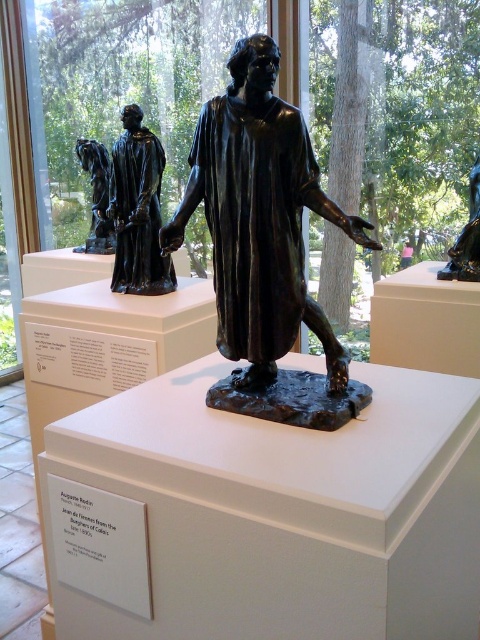
Question: Which point appears closest to the camera in this image?

Choices:
 (A) (350, 404)
 (B) (128, 140)
 (C) (80, 138)
 (D) (479, 272)

Answer: (A)

Question: Among these objects, which one is nearest to the camera?

Choices:
 (A) shiny bronze statue at left
 (B) bronze statue at left

Answer: (A)

Question: Which object is farther from the camera taking this photo?

Choices:
 (A) bronze statue at left
 (B) shiny bronze statue at left
 (C) shiny bronze statue at center

Answer: (A)

Question: Does shiny bronze statue at left have a larger size compared to bronze statue at left?

Choices:
 (A) yes
 (B) no

Answer: (B)

Question: Can you confirm if shiny bronze statue at center is positioned to the right of shiny bronze statue at left?

Choices:
 (A) no
 (B) yes

Answer: (B)

Question: Is shiny bronze statue at center thinner than shiny bronze statue at left?

Choices:
 (A) yes
 (B) no

Answer: (B)